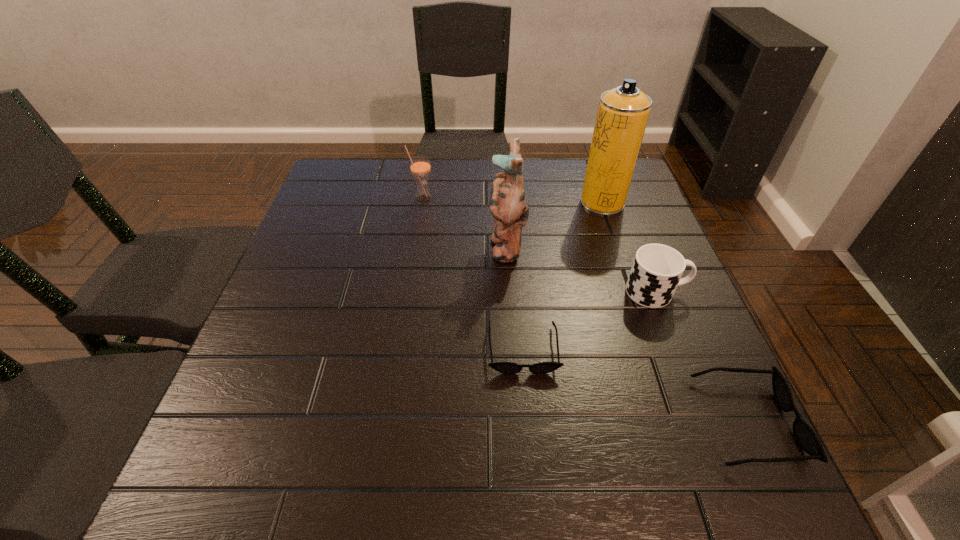
Locate an element on the screen. The image size is (960, 540). object that is the closest to the figurine is located at coordinates 503,367.

The image size is (960, 540). I want to click on free space that satisfies the following two spatial constraints: 1. on the side of the third nearest object with the handle; 2. on the front-facing side of the fifth farthest object, so click(x=678, y=348).